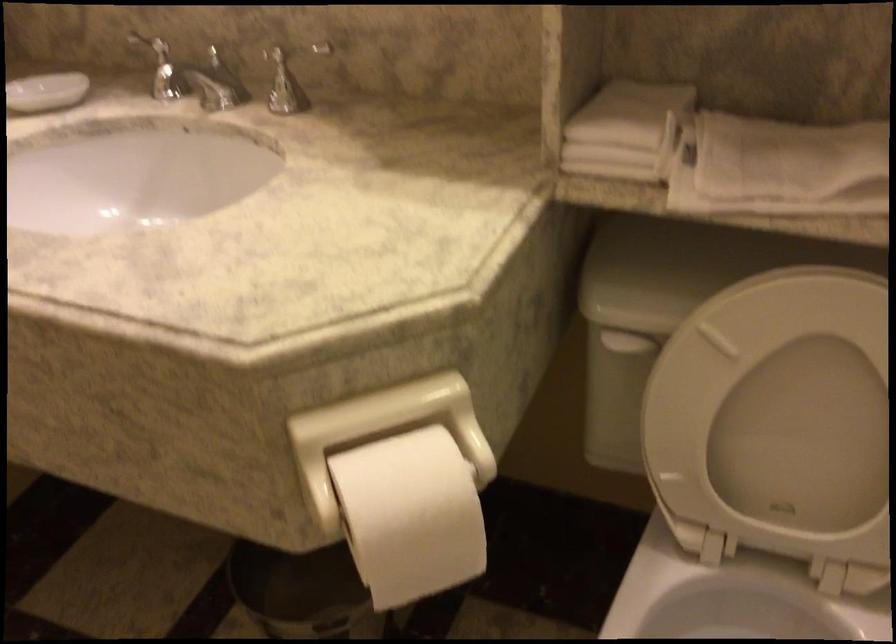
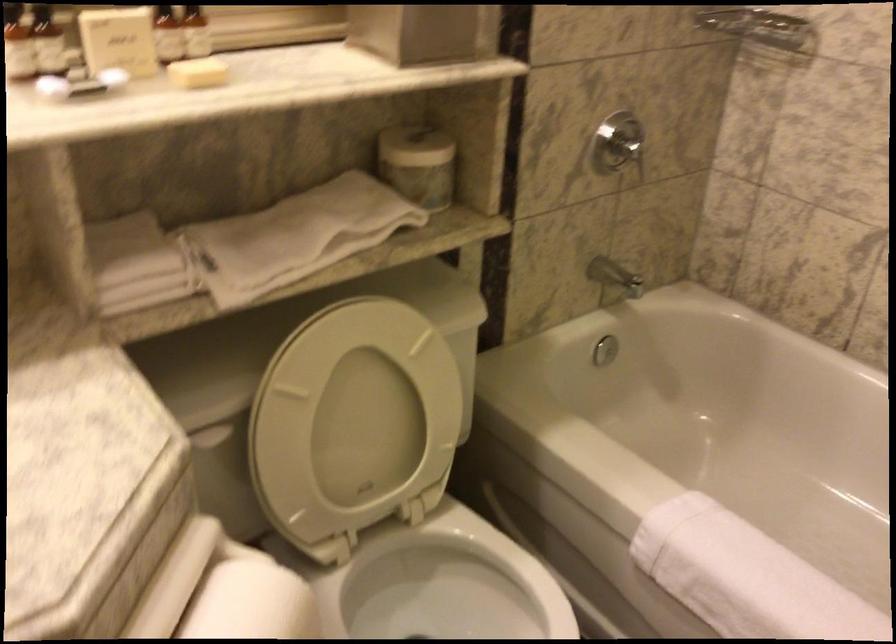
Question: The images are taken continuously from a first-person perspective. In which direction is your viewpoint rotating?

Choices:
 (A) Left
 (B) Right
 (C) Up
 (D) Down

Answer: (B)